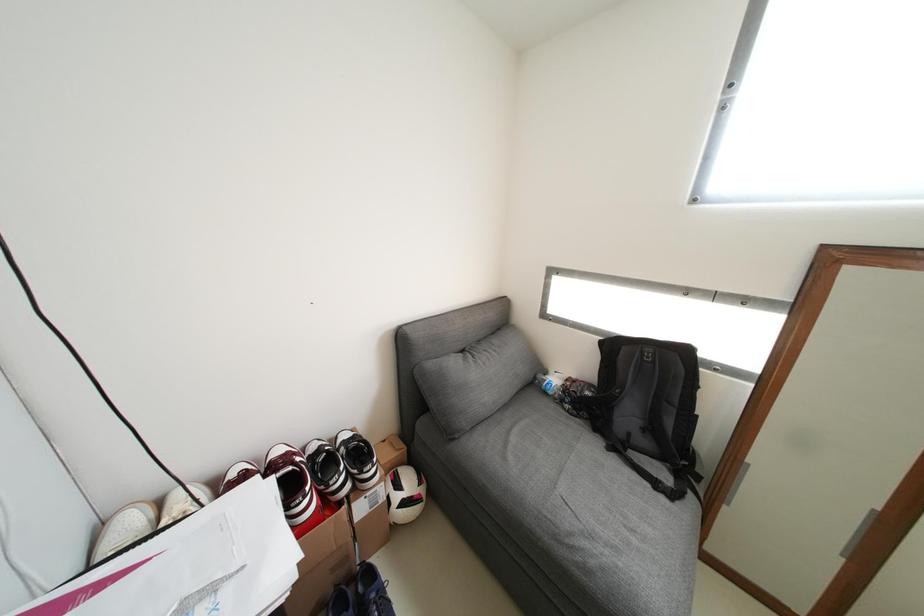
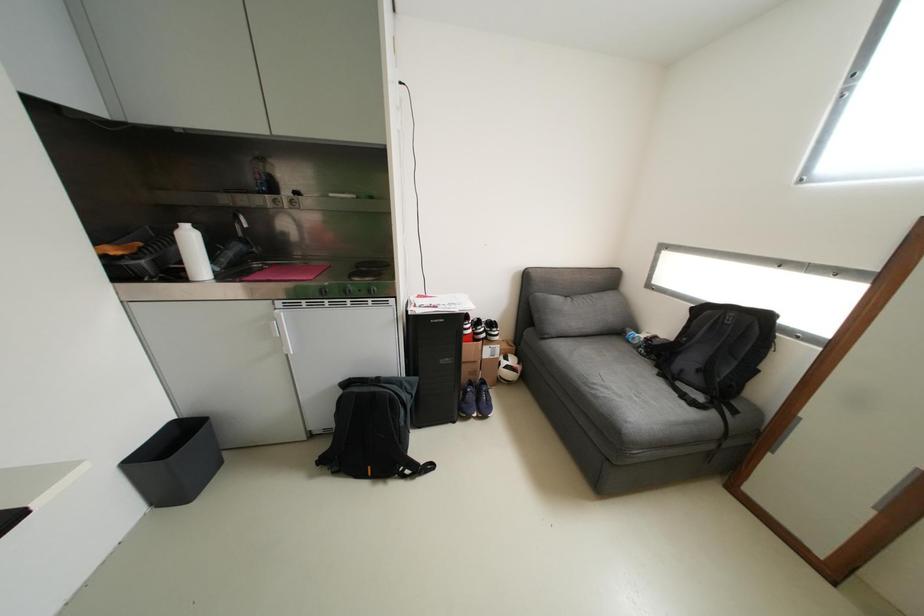
Question: How did the camera likely rotate?

Choices:
 (A) Left
 (B) Right
 (C) Up
 (D) Down

Answer: (A)